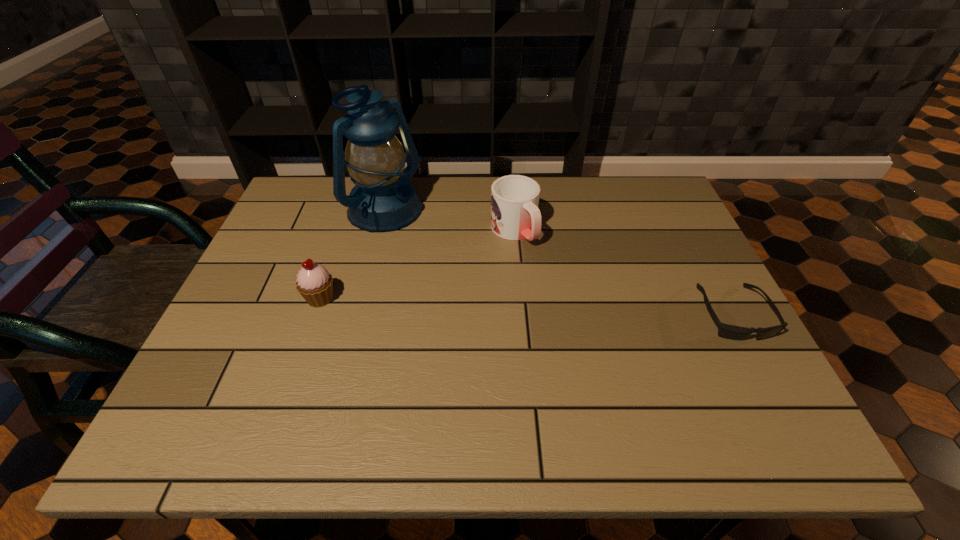
This screenshot has height=540, width=960. I want to click on blank region between the mug and the cupcake, so click(x=417, y=265).

Identify the location of free space that is in between the tallest object and the cupcake. pos(352,256).

The height and width of the screenshot is (540, 960). In order to click on unoccupied area between the shortest object and the cupcake in this screenshot , I will do `click(526, 306)`.

The image size is (960, 540). Find the location of `free space that is in between the cupcake and the shortest object`. free space that is in between the cupcake and the shortest object is located at coordinates (526, 306).

Find the location of `object that is the closest one to the tallest object`. object that is the closest one to the tallest object is located at coordinates (315, 284).

The image size is (960, 540). I want to click on object that can be found as the third closest to the cupcake, so click(x=726, y=331).

You are a GUI agent. You are given a task and a screenshot of the screen. Output one action in this format:
    pyautogui.click(x=<x>, y=<y>)
    Task: Click on the free spot that satisfies the following two spatial constraints: 1. on the front side of the lantern; 2. on the left side of the mug
    The width and height of the screenshot is (960, 540).
    Given the screenshot: What is the action you would take?
    pyautogui.click(x=379, y=231)